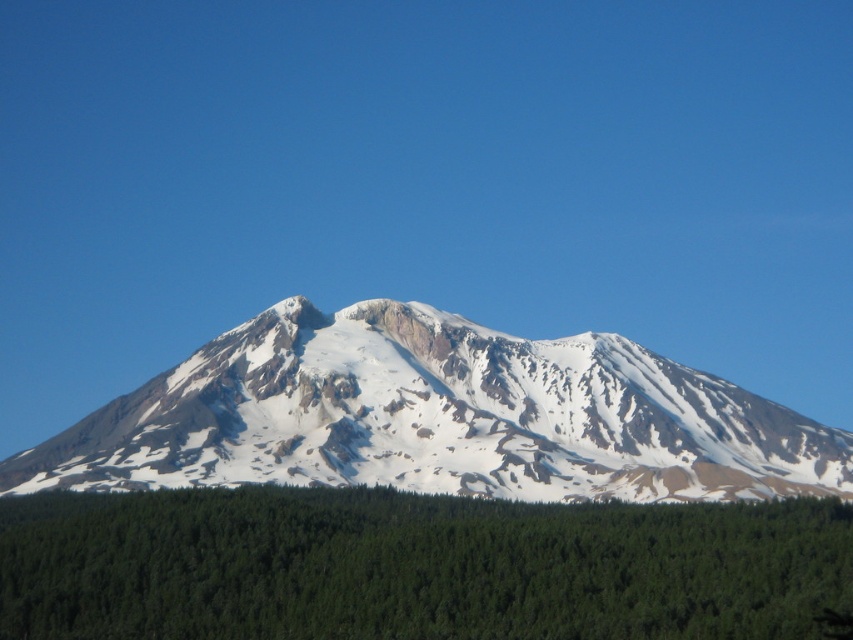
In the scene shown: Is green matte tree at lower center taller than white snow-covered mountain at center?

No, green matte tree at lower center is not taller than white snow-covered mountain at center.

Between green matte tree at lower center and white snow-covered mountain at center, which one has more height?

white snow-covered mountain at center is taller.

Locate an element on the screen. green matte tree at lower center is located at coordinates (415, 566).